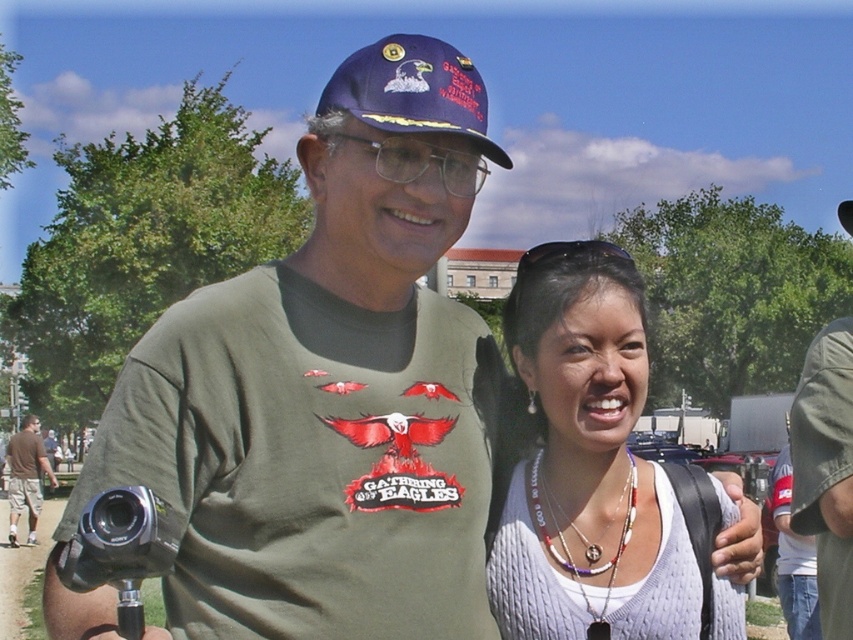
Does point (515, 339) lie behind point (15, 452)?

No, it is in front of (15, 452).

This screenshot has width=853, height=640. What do you see at coordinates (601, 477) in the screenshot? I see `white knitted sweater at center` at bounding box center [601, 477].

Where is `white knitted sweater at center`? Image resolution: width=853 pixels, height=640 pixels. white knitted sweater at center is located at coordinates (601, 477).

Is white knitted sweater at center thinner than transparent plastic goggles at upper center?

Yes, white knitted sweater at center is thinner than transparent plastic goggles at upper center.

Is white knitted sweater at center to the right of transparent plastic goggles at upper center from the viewer's perspective?

No, white knitted sweater at center is not to the right of transparent plastic goggles at upper center.

Locate an element on the screen. The width and height of the screenshot is (853, 640). white knitted sweater at center is located at coordinates (601, 477).

Is white knitted sweater at center taller than blue fabric baseball cap at upper center?

Incorrect, white knitted sweater at center's height is not larger of blue fabric baseball cap at upper center's.

Does point (642, 474) come behind point (509, 161)?

No, (642, 474) is closer to viewer.

Where is `white knitted sweater at center`? Image resolution: width=853 pixels, height=640 pixels. white knitted sweater at center is located at coordinates pyautogui.click(x=601, y=477).